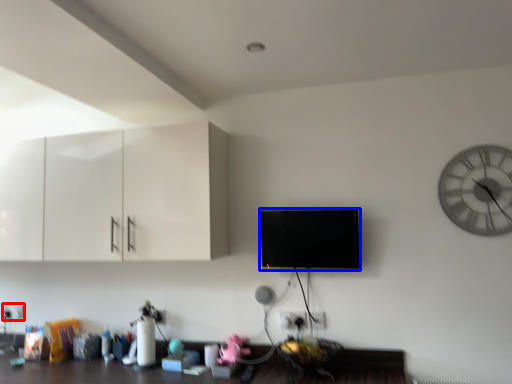
Question: Among these objects, which one is farthest to the camera, electric outlet (highlighted by a red box) or flat (highlighted by a blue box)?

Choices:
 (A) electric outlet
 (B) flat

Answer: (A)